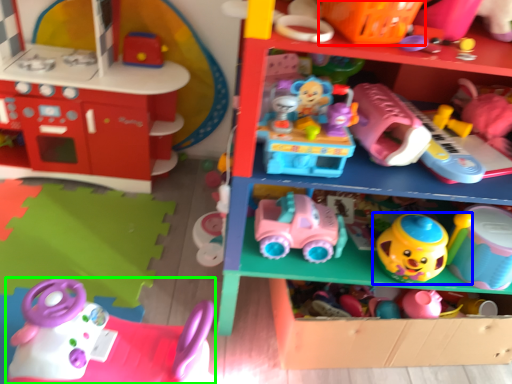
Question: Which object is the farthest from toy (highlighted by a red box)? Choose among these: toy (highlighted by a blue box) or toy (highlighted by a green box).

Choices:
 (A) toy
 (B) toy

Answer: (B)